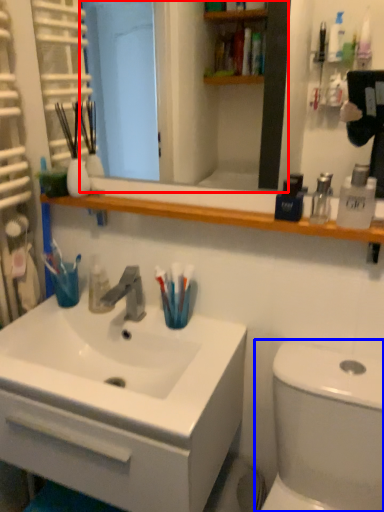
Question: Which object appears closest to the camera in this image, mirror (highlighted by a red box) or toilet (highlighted by a blue box)?

Choices:
 (A) mirror
 (B) toilet

Answer: (B)